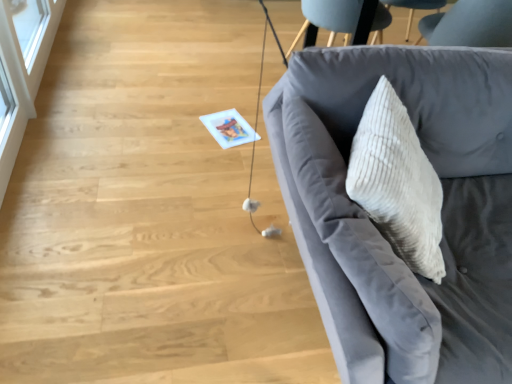
You are a GUI agent. You are given a task and a screenshot of the screen. Output one action in this format:
    pyautogui.click(x=<x>, y=<y>)
    Task: Click on the velvet gray couch at right
    The image size is (512, 384).
    Given the screenshot: What is the action you would take?
    click(375, 228)

What do you see at coordinates (375, 228) in the screenshot? I see `velvet gray couch at right` at bounding box center [375, 228].

Measure the distance between transparent glass door at upper left and camera.

1.71 meters.

This screenshot has height=384, width=512. What are the coordinates of `transparent glass door at upper left` in the screenshot? It's located at (22, 69).

The image size is (512, 384). What do you see at coordinates (22, 69) in the screenshot?
I see `transparent glass door at upper left` at bounding box center [22, 69].

The image size is (512, 384). In order to click on velvet gray couch at right in this screenshot , I will do `click(375, 228)`.

Does velvet gray couch at right appear on the right side of transparent glass door at upper left?

Correct, you'll find velvet gray couch at right to the right of transparent glass door at upper left.

Does velvet gray couch at right lie behind transparent glass door at upper left?

No, velvet gray couch at right is in front of transparent glass door at upper left.

Considering the positions of point (335, 239) and point (6, 137), is point (335, 239) closer or farther from the camera than point (6, 137)?

Clearly, point (335, 239) is closer to the camera than point (6, 137).

From the image's perspective, is velvet gray couch at right on transparent glass door at upper left?

No.

From a real-world perspective, is velvet gray couch at right positioned under transparent glass door at upper left based on gravity?

Incorrect, from a real-world perspective, velvet gray couch at right is higher than transparent glass door at upper left.

From the picture: Can you confirm if velvet gray couch at right is thinner than transparent glass door at upper left?

No, velvet gray couch at right is not thinner than transparent glass door at upper left.

Does velvet gray couch at right have a greater height compared to transparent glass door at upper left?

Correct, velvet gray couch at right is much taller as transparent glass door at upper left.

Can you confirm if velvet gray couch at right is bigger than transparent glass door at upper left?

Correct, velvet gray couch at right is larger in size than transparent glass door at upper left.

Is velvet gray couch at right not inside transparent glass door at upper left?

Yes, velvet gray couch at right is outside of transparent glass door at upper left.

Would you consider velvet gray couch at right to be distant from transparent glass door at upper left?

Yes.

Is velvet gray couch at right positioned with its back to transparent glass door at upper left?

velvet gray couch at right does not have its back to transparent glass door at upper left.

Based on the photo, how many degrees apart are the facing directions of velvet gray couch at right and transparent glass door at upper left?

91.4 degrees separate the facing orientations of velvet gray couch at right and transparent glass door at upper left.

This screenshot has width=512, height=384. What are the coordinates of `glass door above the velvet gray couch at right (from the image's perspective)` in the screenshot? It's located at (22, 69).

Would you say transparent glass door at upper left is to the left or to the right of velvet gray couch at right in the picture?

In the image, transparent glass door at upper left appears on the left side of velvet gray couch at right.

Considering their positions, is transparent glass door at upper left located in front of or behind velvet gray couch at right?

transparent glass door at upper left is behind velvet gray couch at right.

Which is in front, point (57, 1) or point (328, 165)?

The point (328, 165) is in front.

From the image's perspective, is transparent glass door at upper left on velvet gray couch at right?

Yes, from the image's perspective, transparent glass door at upper left is over velvet gray couch at right.

Based on the photo, from a real-world perspective, is transparent glass door at upper left located higher than velvet gray couch at right?

Actually, transparent glass door at upper left is physically below velvet gray couch at right in the real world.

Looking at their sizes, would you say transparent glass door at upper left is wider or thinner than velvet gray couch at right?

Considering their sizes, transparent glass door at upper left looks slimmer than velvet gray couch at right.

Consider the image. Considering the sizes of transparent glass door at upper left and velvet gray couch at right in the image, is transparent glass door at upper left taller or shorter than velvet gray couch at right?

Considering their sizes, transparent glass door at upper left has less height than velvet gray couch at right.

Can you confirm if transparent glass door at upper left is bigger than velvet gray couch at right?

Actually, transparent glass door at upper left might be smaller than velvet gray couch at right.

Consider the image. Is transparent glass door at upper left located outside velvet gray couch at right?

transparent glass door at upper left lies outside velvet gray couch at right's area.

Are transparent glass door at upper left and velvet gray couch at right beside each other?

No.

Is transparent glass door at upper left looking in the opposite direction of velvet gray couch at right?

That's not correct — transparent glass door at upper left is not looking away from velvet gray couch at right.

Find the location of a particular element. The height and width of the screenshot is (384, 512). studio couch to the right of transparent glass door at upper left is located at coordinates (375, 228).

Where is `glass door above the velvet gray couch at right (from the image's perspective)`? The height and width of the screenshot is (384, 512). glass door above the velvet gray couch at right (from the image's perspective) is located at coordinates tap(22, 69).

Where is `studio couch positioned vertically above the transparent glass door at upper left (from a real-world perspective)`? Image resolution: width=512 pixels, height=384 pixels. studio couch positioned vertically above the transparent glass door at upper left (from a real-world perspective) is located at coordinates (375, 228).